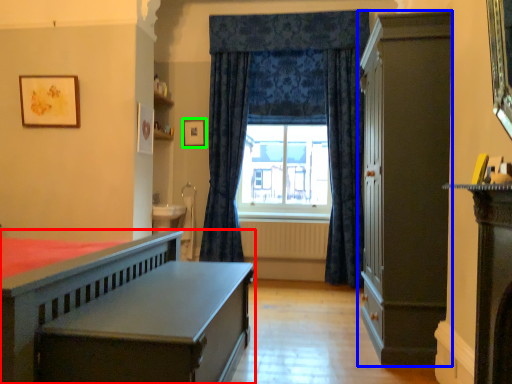
Question: Which object is the closest to the bed (highlighted by a red box)? Choose among these: cabinetry (highlighted by a blue box) or picture frame (highlighted by a green box).

Choices:
 (A) cabinetry
 (B) picture frame

Answer: (A)